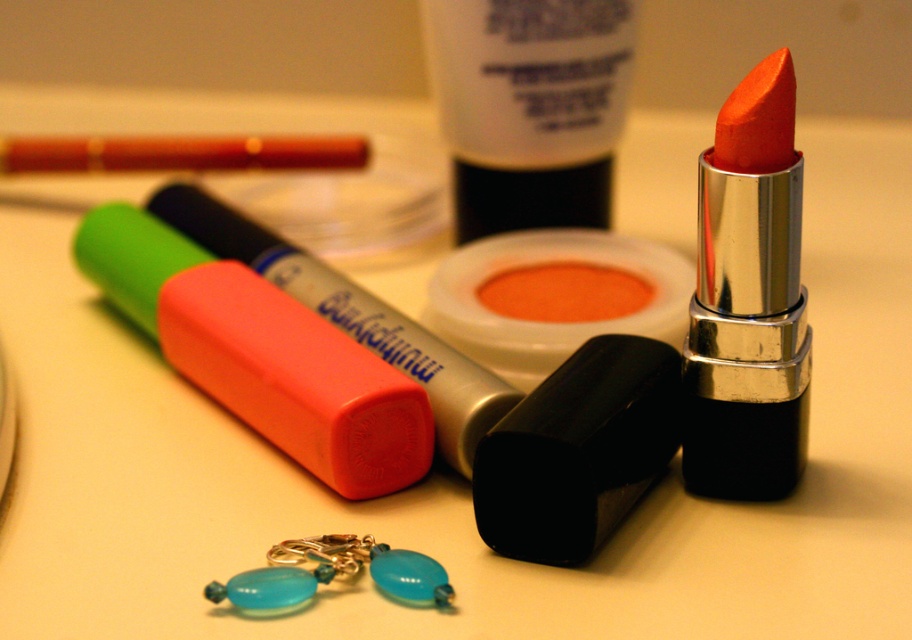
You are holding a 2.5 feet long ruler and want to measure the distance between the rubberized plastic highlighter at center and the camera. Can your ruler reach that distance?

The distance between the rubberized plastic highlighter at center and the camera is 3.37 feet, which is longer than the 2.5 feet ruler you have. Therefore, the ruler cannot reach the full distance.

You are organizing beauty products on a shelf and need to place the rubberized plastic highlighter at center and the matte orange lip balm at center. According to their positions in the image, which one should you place first to maintain the same spatial arrangement?

The rubberized plastic highlighter at center should be placed first because it is in front of the matte orange lip balm at center in the image, so placing it first will maintain the front position.

You are standing in front of the beauty items arranged on the countertop. The point marked at coordinates point (299, 396) is where you want to place a new perfume bottle. Considering the space available, can you determine if the point is within reach of your hand if your hand can extend 3 feet from your body?

The point marked at coordinates point (299, 396) is 3.50 feet from the viewer. Since your hand can only extend 3 feet, the point is 0.5 feet beyond your reach. You cannot place the perfume bottle there with your current reach.